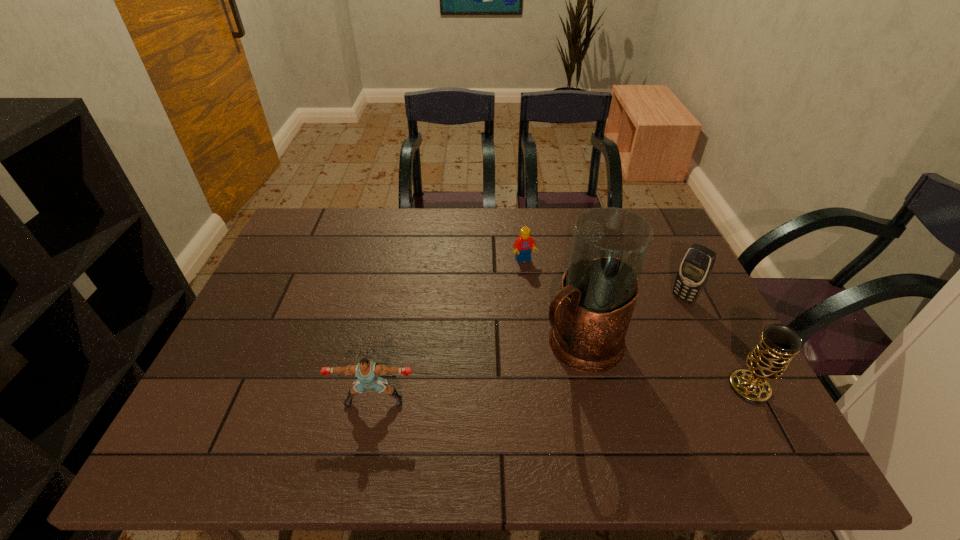
Find the location of a particular element. Image resolution: width=960 pixels, height=540 pixels. cellular telephone located in the right edge section of the desktop is located at coordinates (697, 264).

Find the location of `object located at the near right corner`. object located at the near right corner is located at coordinates (768, 360).

Identify the location of vacant space at the far edge of the desktop. (554, 210).

In order to click on vacant region at the near edge of the desktop in this screenshot , I will do `click(503, 412)`.

In the image, there is a desktop. At what (x,y) coordinates should I click in order to perform the action: click on vacant area at the left edge. Please return your answer as a coordinate pair (x, y). Looking at the image, I should click on (324, 258).

The width and height of the screenshot is (960, 540). In the image, there is a desktop. Identify the location of vacant space at the right edge. (676, 272).

I want to click on blank space at the far left corner, so click(x=330, y=215).

In the image, there is a desktop. Find the location of `vacant area at the near left corner`. vacant area at the near left corner is located at coordinates (238, 406).

This screenshot has height=540, width=960. What are the coordinates of `vacant region between the farthest object and the puncher` in the screenshot? It's located at (449, 331).

I want to click on free area in between the chalice and the pitcher, so click(x=665, y=366).